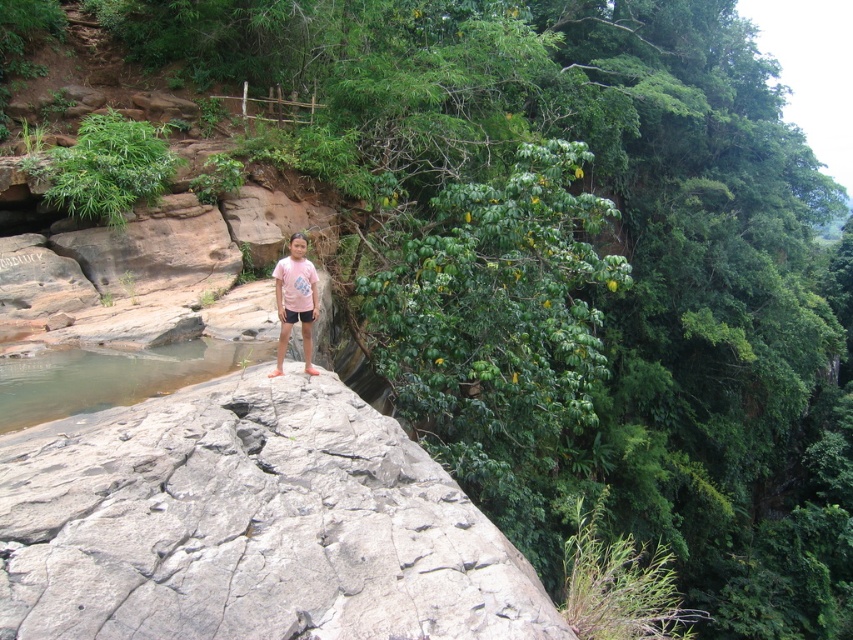
Question: Can you confirm if gray rough rock at center is positioned to the left of clear water at rock edge?

Choices:
 (A) no
 (B) yes

Answer: (A)

Question: Considering the relative positions of gray rough rock at center and clear water at rock edge in the image provided, where is gray rough rock at center located with respect to clear water at rock edge?

Choices:
 (A) above
 (B) below

Answer: (B)

Question: Which object is farther from the camera taking this photo?

Choices:
 (A) clear water at rock edge
 (B) gray rough rock at center

Answer: (A)

Question: Does gray rough rock at center lie in front of clear water at rock edge?

Choices:
 (A) yes
 (B) no

Answer: (A)

Question: Which of the following is the farthest from the observer?

Choices:
 (A) (15, 381)
 (B) (141, 432)

Answer: (A)

Question: Which point is farther to the camera?

Choices:
 (A) (361, 460)
 (B) (155, 362)

Answer: (B)